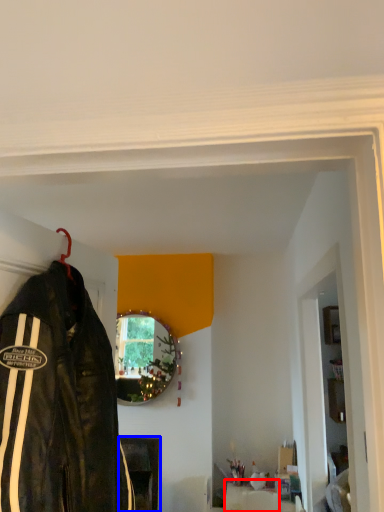
Question: Which object is closer to the camera taking this photo, furniture (highlighted by a red box) or furniture (highlighted by a blue box)?

Choices:
 (A) furniture
 (B) furniture

Answer: (A)